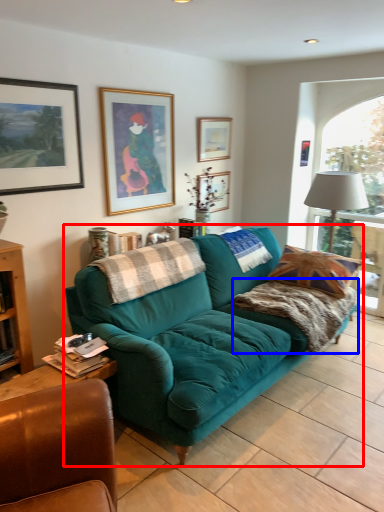
Question: Which object is closer to the camera taking this photo, studio couch (highlighted by a red box) or blanket (highlighted by a blue box)?

Choices:
 (A) studio couch
 (B) blanket

Answer: (A)